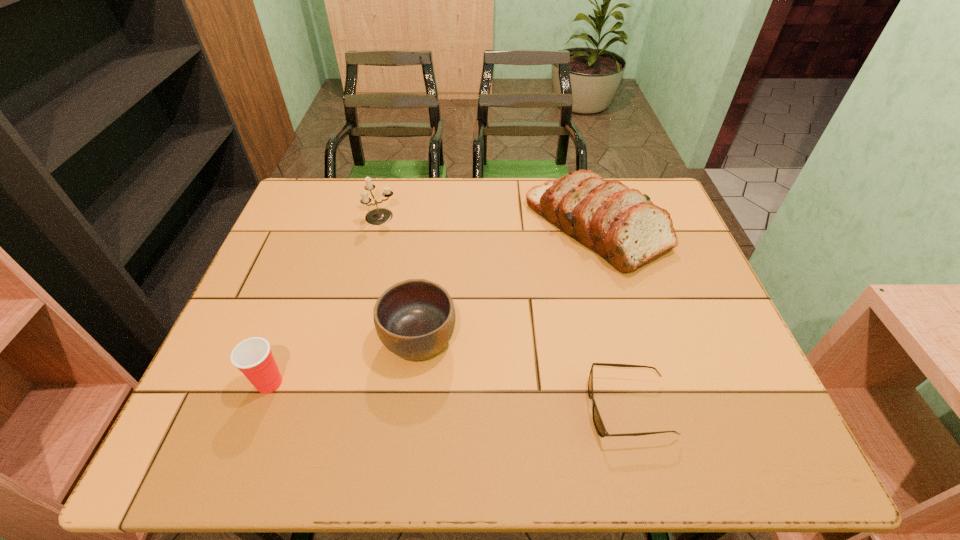
The height and width of the screenshot is (540, 960). In order to click on bread in this screenshot , I will do `click(622, 225)`.

Locate an element on the screen. Image resolution: width=960 pixels, height=540 pixels. the fourth object from right to left is located at coordinates (379, 216).

This screenshot has width=960, height=540. What are the coordinates of `the third object from right to left` in the screenshot? It's located at (414, 319).

The image size is (960, 540). Find the location of `Dixie cup`. Dixie cup is located at coordinates coord(253,357).

You are a GUI agent. You are given a task and a screenshot of the screen. Output one action in this format:
    pyautogui.click(x=<x>, y=<y>)
    Task: Click on the sunglasses
    This screenshot has height=540, width=960.
    Given the screenshot: What is the action you would take?
    pyautogui.click(x=597, y=420)

The height and width of the screenshot is (540, 960). Find the location of `free space located on the left of the bread`. free space located on the left of the bread is located at coordinates (490, 227).

This screenshot has width=960, height=540. What are the coordinates of `free space located on the back of the second object from left to right` in the screenshot? It's located at (387, 195).

This screenshot has height=540, width=960. I want to click on free point located 0.080m on the back of the bowl, so click(x=425, y=287).

At what (x,y) coordinates should I click in order to perform the action: click on free region located 0.380m on the back of the Dixie cup. Please return your answer as a coordinate pair (x, y). The height and width of the screenshot is (540, 960). Looking at the image, I should click on (320, 250).

Locate an element on the screen. This screenshot has width=960, height=540. vacant area situated on the lenses of the shortest object is located at coordinates (520, 408).